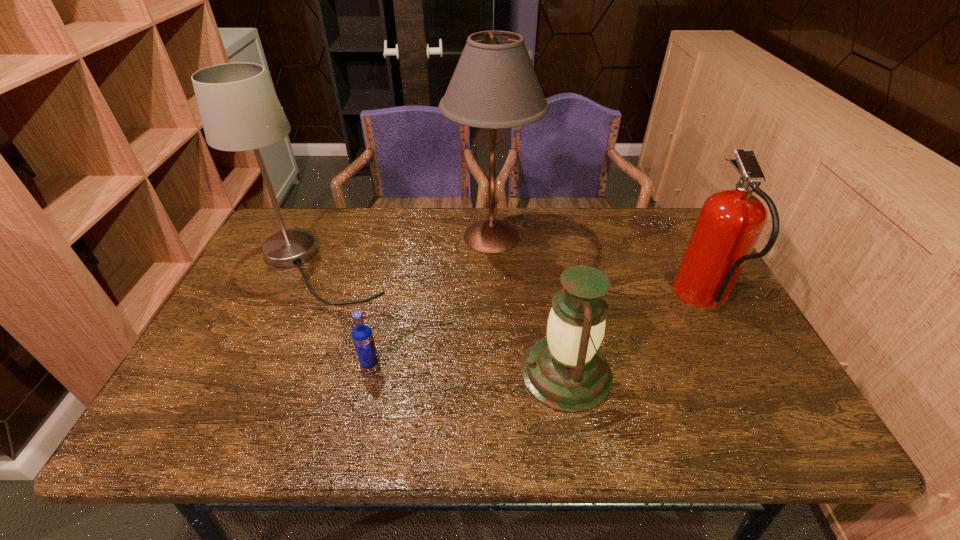
Locate an element on the screen. The image size is (960, 540). empty space that is in between the second shortest object and the left table lamp is located at coordinates (444, 320).

Image resolution: width=960 pixels, height=540 pixels. In order to click on free space between the lantern and the third tallest object in this screenshot , I will do `click(635, 336)`.

Where is `free space between the vodka and the third tallest object`? The image size is (960, 540). free space between the vodka and the third tallest object is located at coordinates click(538, 334).

Locate an element on the screen. empty space between the left table lamp and the lantern is located at coordinates (444, 320).

This screenshot has width=960, height=540. Identify the location of free space between the right table lamp and the lantern. (529, 305).

Locate an element on the screen. blank region between the fourth tallest object and the third tallest object is located at coordinates (635, 336).

At what (x,y) coordinates should I click in order to perform the action: click on object that stands as the third closest to the left table lamp. Please return your answer as a coordinate pair (x, y). Image resolution: width=960 pixels, height=540 pixels. Looking at the image, I should click on (565, 371).

Choose which object is the nearest neighbor to the right table lamp. Please provide its 2D coordinates. Your answer should be formatted as a tuple, i.e. [(x, y)], where the tuple contains the x and y coordinates of a point satisfying the conditions above.

[(239, 109)]

The image size is (960, 540). I want to click on free space that satisfies the following two spatial constraints: 1. with the handle and nozzle on the fire extinguisher; 2. on the front side of the shortest object, so click(740, 368).